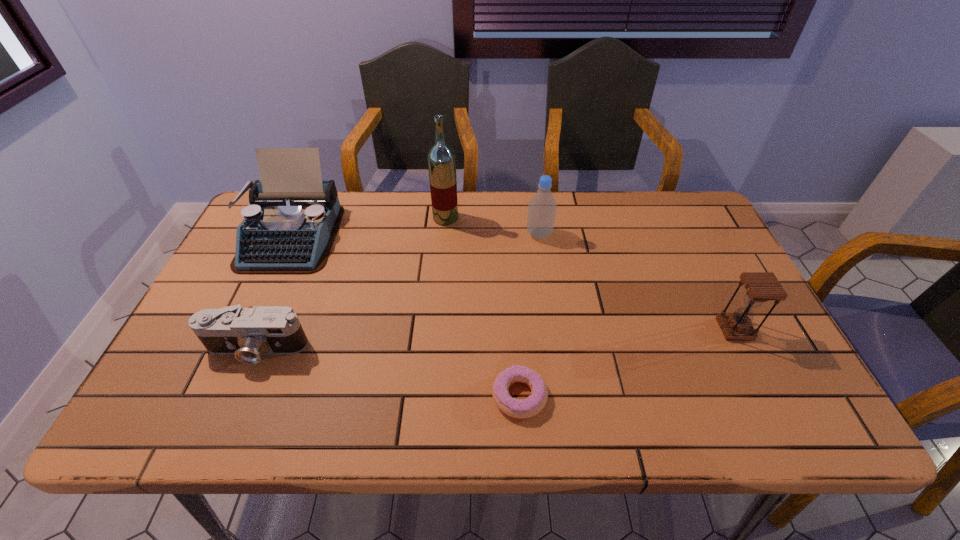
Choose which object is the fifth nearest neighbor to the typewriter. Please provide its 2D coordinates. Your answer should be formatted as a tuple, i.e. [(x, y)], where the tuple contains the x and y coordinates of a point satisfying the conditions above.

[(760, 287)]

Identify the location of vacant region that satisfies the following two spatial constraints: 1. on the back side of the shortest object; 2. on the right side of the bottle. (509, 234).

Where is `free spot that satisfies the following two spatial constraints: 1. on the typing side of the third shortest object; 2. on the right side of the typewriter`? The height and width of the screenshot is (540, 960). free spot that satisfies the following two spatial constraints: 1. on the typing side of the third shortest object; 2. on the right side of the typewriter is located at coordinates (248, 329).

You are a GUI agent. You are given a task and a screenshot of the screen. Output one action in this format:
    pyautogui.click(x=<x>, y=<y>)
    Task: Click on the vacant region that satisfies the following two spatial constraints: 1. on the typing side of the fourth tallest object; 2. on the left side of the typewriter
    This screenshot has width=960, height=540.
    Given the screenshot: What is the action you would take?
    pyautogui.click(x=248, y=329)